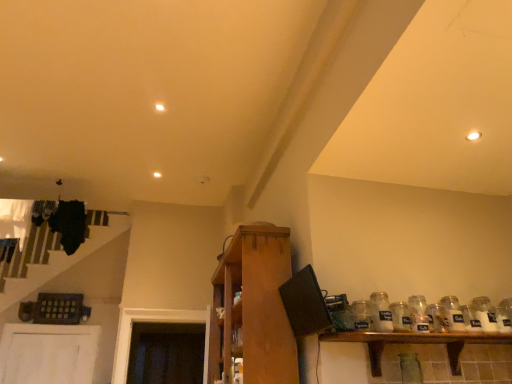
Question: Based on their positions, is white glass jar at right, which is the 3th glass bottle in right-to-left order, located to the left or right of wooden cabinet at center, positioned as the second shelf in right-to-left order?

Choices:
 (A) left
 (B) right

Answer: (B)

Question: Do you think white glass jar at right, which is the 3th glass bottle in right-to-left order, is within wooden cabinet at center, which ranks as the first shelf in left-to-right order, or outside of it?

Choices:
 (A) outside
 (B) inside

Answer: (A)

Question: Estimate the real-world distances between objects in this image. Which object is farther from the white glass jar at right, marked as the fourth glass jar in a left-to-right arrangement?

Choices:
 (A) clear glass jar at right, placed as the second glass bottle when sorted from right to left
 (B) white glass jar at right, which is the 3th glass bottle in right-to-left order
 (C) white glass jar at right, the third glass bottle from the left
 (D) wooden shelf at lower right, the 1th shelf in the right-to-left sequence
 (E) clear glass jar at shelf right, which is the 1th glass jar from left to right

Answer: (E)

Question: Which object is positioned closest to the clear glass jar at right, placed as the second glass jar when sorted from right to left?

Choices:
 (A) white glass jar at right, marked as the 1th glass bottle in a left-to-right arrangement
 (B) wooden cabinet at center, positioned as the second shelf in right-to-left order
 (C) white glass jar at right, the first glass jar positioned from the right
 (D) white glass jar at right, the third glass bottle from the left
 (E) clear glass jar at shelf right, which is the 1th glass jar from left to right

Answer: (D)